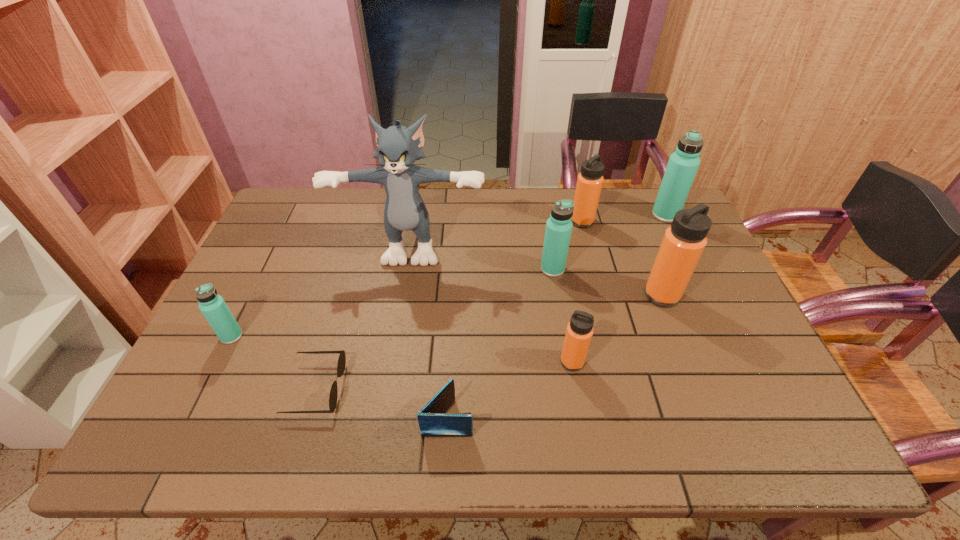
At what (x,y) coordinates should I click in order to perform the action: click on the tallest object. Please return your answer as a coordinate pair (x, y). Looking at the image, I should click on (405, 210).

Locate an element on the screen. This screenshot has width=960, height=540. blue cat is located at coordinates (405, 210).

Locate an element on the screen. The image size is (960, 540). the rightmost thermos bottle is located at coordinates (683, 164).

Find the location of a particular element. This screenshot has width=960, height=540. the farthest aqua thermos bottle is located at coordinates (683, 164).

At what (x,y) coordinates should I click in order to perform the action: click on the biggest orange thermos bottle. Please return your answer as a coordinate pair (x, y). The width and height of the screenshot is (960, 540). Looking at the image, I should click on (684, 241).

Find the location of `the fifth nearest object`. the fifth nearest object is located at coordinates (684, 241).

Identify the location of the third object from right to left. The width and height of the screenshot is (960, 540). (589, 183).

Where is `the farthest orange thermos bottle`? The image size is (960, 540). the farthest orange thermos bottle is located at coordinates (589, 183).

Identify the location of the second smallest aqua thermos bottle. The width and height of the screenshot is (960, 540). (558, 230).

This screenshot has width=960, height=540. I want to click on the second farthest aqua thermos bottle, so click(x=558, y=230).